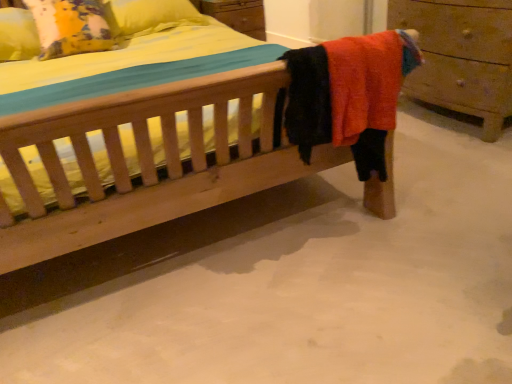
The height and width of the screenshot is (384, 512). What do you see at coordinates (312, 287) in the screenshot? I see `white smooth concrete at lower center` at bounding box center [312, 287].

In order to face yellow fabric pillow at upper left, should I rotate leftwards or rightwards?

A 23.102 degree turn to the left will do.

Image resolution: width=512 pixels, height=384 pixels. Find the location of `yellow fabric pillow at upper left`. yellow fabric pillow at upper left is located at coordinates (70, 27).

In order to click on wooden chest of drawers at right in this screenshot , I will do `click(461, 58)`.

Is wooden chest of drawers at right further to camera compared to yellow fabric pillow at upper left?

No, wooden chest of drawers at right is in front of yellow fabric pillow at upper left.

Is wooden chest of drawers at right bigger than yellow fabric pillow at upper left?

Yes, wooden chest of drawers at right is bigger than yellow fabric pillow at upper left.

I want to click on the chest of drawers below the yellow fabric pillow at upper left (from a real-world perspective), so click(x=461, y=58).

From the image's perspective, would you say yellow fabric pillow at upper left is shown under white smooth concrete at lower center?

Actually, yellow fabric pillow at upper left appears above white smooth concrete at lower center in the image.

From a real-world perspective, is yellow fabric pillow at upper left on white smooth concrete at lower center?

Yes.

Considering the sizes of objects yellow fabric pillow at upper left and white smooth concrete at lower center in the image provided, who is wider, yellow fabric pillow at upper left or white smooth concrete at lower center?

white smooth concrete at lower center is wider.

Are yellow fabric pillow at upper left and white smooth concrete at lower center beside each other?

No, yellow fabric pillow at upper left is not with white smooth concrete at lower center.

Can you confirm if wooden chest of drawers at right is taller than white smooth concrete at lower center?

Yes, wooden chest of drawers at right is taller than white smooth concrete at lower center.

Considering the sizes of wooden chest of drawers at right and white smooth concrete at lower center in the image, is wooden chest of drawers at right bigger or smaller than white smooth concrete at lower center?

wooden chest of drawers at right is smaller than white smooth concrete at lower center.

Which point is more forward, (442, 76) or (463, 189)?

The point (463, 189) is in front.

Which object is closer to the camera, white smooth concrete at lower center or yellow fabric pillow at upper left?

white smooth concrete at lower center.

Is white smooth concrete at lower center oriented away from yellow fabric pillow at upper left?

white smooth concrete at lower center does not have its back to yellow fabric pillow at upper left.

From the picture: Considering the relative positions of white smooth concrete at lower center and yellow fabric pillow at upper left in the image provided, is white smooth concrete at lower center to the right of yellow fabric pillow at upper left from the viewer's perspective?

Indeed, white smooth concrete at lower center is positioned on the right side of yellow fabric pillow at upper left.

Considering the relative sizes of white smooth concrete at lower center and yellow fabric pillow at upper left in the image provided, is white smooth concrete at lower center wider than yellow fabric pillow at upper left?

Indeed, white smooth concrete at lower center has a greater width compared to yellow fabric pillow at upper left.

Who is bigger, yellow fabric pillow at upper left or wooden chest of drawers at right?

wooden chest of drawers at right is bigger.

Is yellow fabric pillow at upper left at the left side of wooden chest of drawers at right?

Yes, yellow fabric pillow at upper left is to the left of wooden chest of drawers at right.

Which of these two, yellow fabric pillow at upper left or wooden chest of drawers at right, is wider?

yellow fabric pillow at upper left is wider.

Is yellow fabric pillow at upper left surrounding wooden chest of drawers at right?

No, wooden chest of drawers at right is not a part of yellow fabric pillow at upper left.

Would you say white smooth concrete at lower center is inside or outside wooden chest of drawers at right?

white smooth concrete at lower center exists outside the volume of wooden chest of drawers at right.

Is white smooth concrete at lower center thinner than wooden chest of drawers at right?

In fact, white smooth concrete at lower center might be wider than wooden chest of drawers at right.

In the scene shown: Is white smooth concrete at lower center positioned in front of wooden chest of drawers at right?

Yes, it is in front of wooden chest of drawers at right.

What's the angular difference between white smooth concrete at lower center and wooden chest of drawers at right's facing directions?

The facing directions of white smooth concrete at lower center and wooden chest of drawers at right are 90.5 degrees apart.

I want to click on pillow behind the wooden chest of drawers at right, so click(x=70, y=27).

This screenshot has width=512, height=384. Identify the location of concrete in front of the yellow fabric pillow at upper left. (312, 287).

From the image, which object appears to be nearer to wooden chest of drawers at right, yellow fabric pillow at upper left or white smooth concrete at lower center?

Based on the image, white smooth concrete at lower center appears to be nearer to wooden chest of drawers at right.

From the image, which object appears to be nearer to white smooth concrete at lower center, wooden chest of drawers at right or yellow fabric pillow at upper left?

wooden chest of drawers at right is positioned closer to the anchor white smooth concrete at lower center.

Looking at the image, which one is located closer to white smooth concrete at lower center, yellow fabric pillow at upper left or wooden chest of drawers at right?

Among the two, wooden chest of drawers at right is located nearer to white smooth concrete at lower center.

Consider the image. Looking at the image, which one is located closer to wooden chest of drawers at right, white smooth concrete at lower center or yellow fabric pillow at upper left?

Based on the image, white smooth concrete at lower center appears to be nearer to wooden chest of drawers at right.

Looking at the image, which one is located further to yellow fabric pillow at upper left, wooden chest of drawers at right or white smooth concrete at lower center?

wooden chest of drawers at right is further to yellow fabric pillow at upper left.

When comparing their distances from yellow fabric pillow at upper left, does white smooth concrete at lower center or wooden chest of drawers at right seem further?

wooden chest of drawers at right is positioned further to the anchor yellow fabric pillow at upper left.

This screenshot has width=512, height=384. In order to click on concrete between yellow fabric pillow at upper left and wooden chest of drawers at right in this screenshot , I will do `click(312, 287)`.